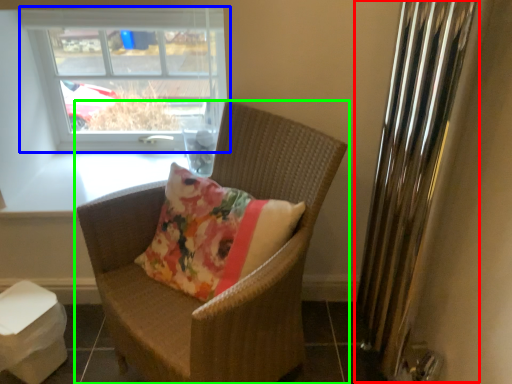
Question: Estimate the real-world distances between objects in this image. Which object is closer to radiator (highlighted by a red box), window (highlighted by a blue box) or chair (highlighted by a green box)?

Choices:
 (A) window
 (B) chair

Answer: (B)